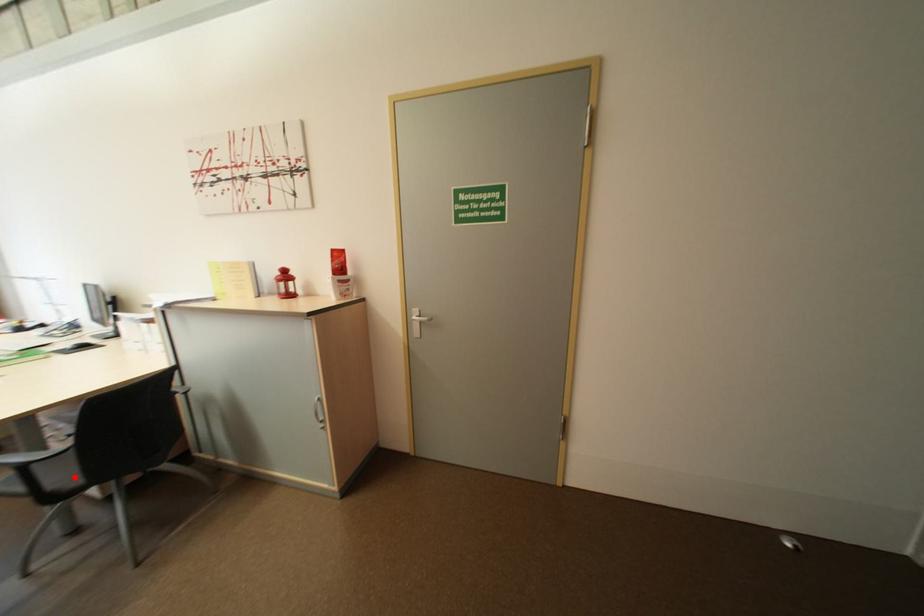
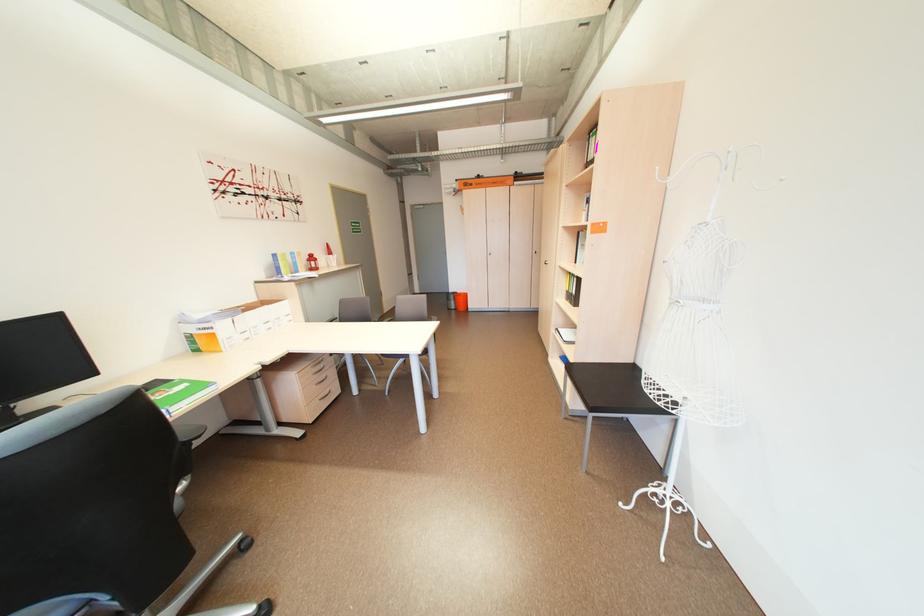
Question: I am providing you with two images of the same scene from different viewpoints. A red point is marked on the first image. Can you still see the location of the red point in image 2?

Choices:
 (A) Yes
 (B) No

Answer: (B)